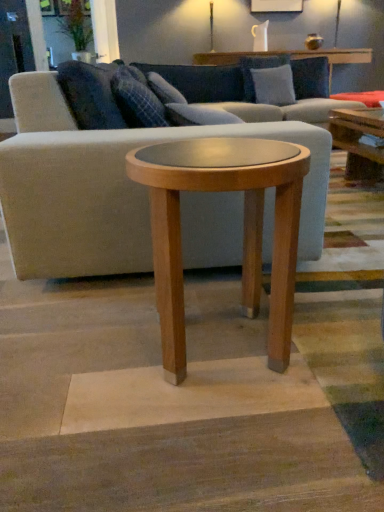
Question: From the image's perspective, is light gray fabric couch at center beneath light brown wood side table at center?

Choices:
 (A) yes
 (B) no

Answer: (B)

Question: Is light gray fabric couch at center thinner than light brown wood side table at center?

Choices:
 (A) yes
 (B) no

Answer: (B)

Question: Is light brown wood side table at center a part of light gray fabric couch at center?

Choices:
 (A) no
 (B) yes

Answer: (A)

Question: Is light gray fabric couch at center not close to light brown wood side table at center?

Choices:
 (A) no
 (B) yes

Answer: (A)

Question: Does light gray fabric couch at center appear on the right side of light brown wood side table at center?

Choices:
 (A) no
 (B) yes

Answer: (B)

Question: In the image, is gray fabric pillow at upper center, which appears as the 2th pillow when viewed from the back, positioned in front of or behind plaid fabric pillow at center, which is the 3th pillow from back to front?

Choices:
 (A) behind
 (B) front

Answer: (A)

Question: From a real-world perspective, is gray fabric pillow at upper center, the 2th pillow when ordered from front to back, physically located above or below plaid fabric pillow at center, which is the 3th pillow from back to front?

Choices:
 (A) above
 (B) below

Answer: (B)

Question: Is gray fabric pillow at upper center, the 2th pillow when ordered from front to back, situated inside plaid fabric pillow at center, which is the 3th pillow from back to front, or outside?

Choices:
 (A) inside
 (B) outside

Answer: (B)

Question: Considering the positions of point (254, 70) and point (122, 105), is point (254, 70) closer or farther from the camera than point (122, 105)?

Choices:
 (A) farther
 (B) closer

Answer: (A)

Question: Is light brown wood side table at center in front of or behind light gray fabric couch at center in the image?

Choices:
 (A) front
 (B) behind

Answer: (A)

Question: Does point (215, 155) appear closer or farther from the camera than point (66, 194)?

Choices:
 (A) closer
 (B) farther

Answer: (A)

Question: From a real-world perspective, is light brown wood side table at center positioned above or below light gray fabric couch at center?

Choices:
 (A) below
 (B) above

Answer: (A)

Question: Is light brown wood side table at center inside the boundaries of light gray fabric couch at center, or outside?

Choices:
 (A) outside
 (B) inside

Answer: (A)

Question: From a real-world perspective, is gray fabric pillow at upper center, marked as the 2th pillow in a left-to-right arrangement, above or below light gray fabric couch at center?

Choices:
 (A) below
 (B) above

Answer: (B)

Question: Visually, is gray fabric pillow at upper center, the 2th pillow when ordered from front to back, positioned to the left or to the right of light gray fabric couch at center?

Choices:
 (A) left
 (B) right

Answer: (B)